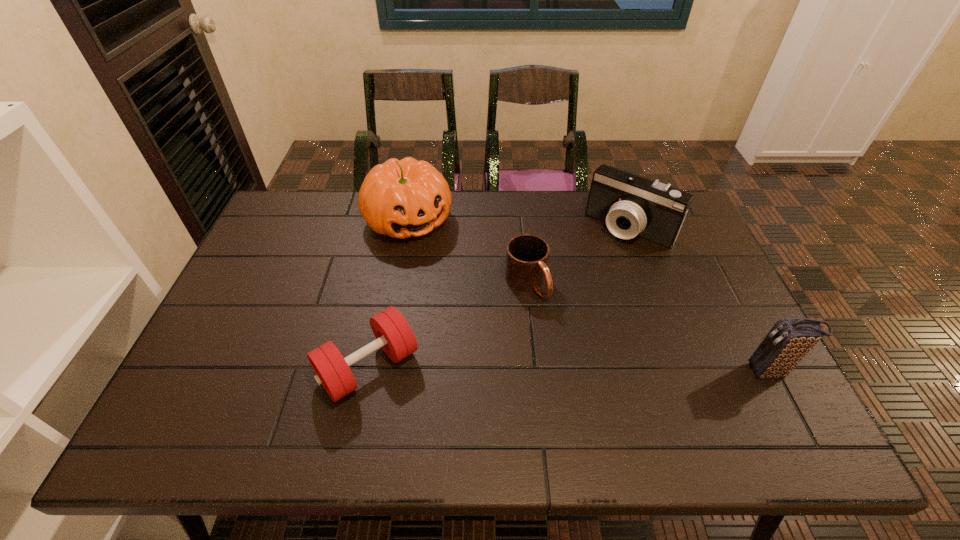
Find the location of a particular element. dumbbell is located at coordinates (393, 334).

In order to click on the rightmost object in this screenshot , I will do `click(790, 339)`.

At what (x,y) coordinates should I click in order to perform the action: click on the third object from left to right. Please return your answer as a coordinate pair (x, y). This screenshot has width=960, height=540. Looking at the image, I should click on (527, 255).

Where is `mug`? This screenshot has width=960, height=540. mug is located at coordinates (527, 255).

At what (x,y) coordinates should I click in order to perform the action: click on pumpkin. Please return your answer as a coordinate pair (x, y). The width and height of the screenshot is (960, 540). Looking at the image, I should click on (401, 198).

Identify the location of the second object from right to left. This screenshot has height=540, width=960. (631, 205).

You are a GUI agent. You are given a task and a screenshot of the screen. Output one action in this format:
    pyautogui.click(x=<x>, y=<y>)
    Task: Click on the blank space located on the left of the dumbbell
    The image size is (960, 540).
    Given the screenshot: What is the action you would take?
    pyautogui.click(x=293, y=367)

Image resolution: width=960 pixels, height=540 pixels. In order to click on free space located 0.050m with the zip open on the rightmost object in this screenshot , I will do `click(725, 372)`.

The width and height of the screenshot is (960, 540). In order to click on vacant region located 0.200m with the zip open on the rightmost object in this screenshot , I will do pyautogui.click(x=662, y=372).

Where is `free point located 0.340m with the zip open on the rightmost object`? free point located 0.340m with the zip open on the rightmost object is located at coordinates (604, 372).